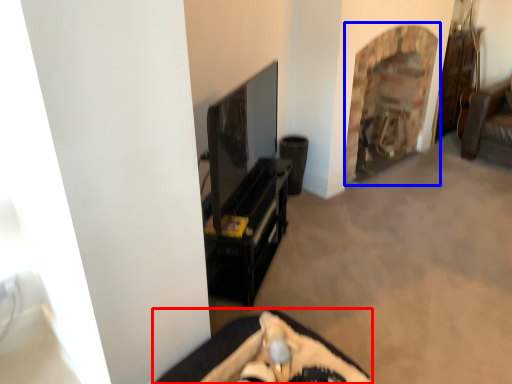
Question: Which of the following is the closest to the observer, furniture (highlighted by a red box) or fireplace (highlighted by a blue box)?

Choices:
 (A) furniture
 (B) fireplace

Answer: (A)